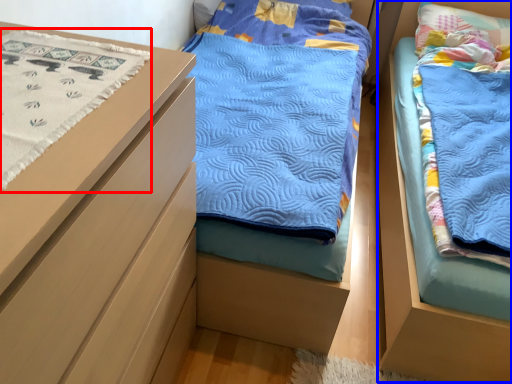
Question: Among these objects, which one is farthest to the camera, blanket (highlighted by a red box) or bed (highlighted by a blue box)?

Choices:
 (A) blanket
 (B) bed

Answer: (B)